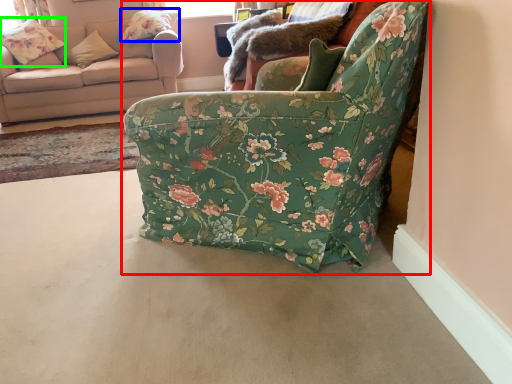
Question: Estimate the real-world distances between objects in this image. Which object is farther from chair (highlighted by a red box), pillow (highlighted by a blue box) or flower (highlighted by a green box)?

Choices:
 (A) pillow
 (B) flower

Answer: (B)